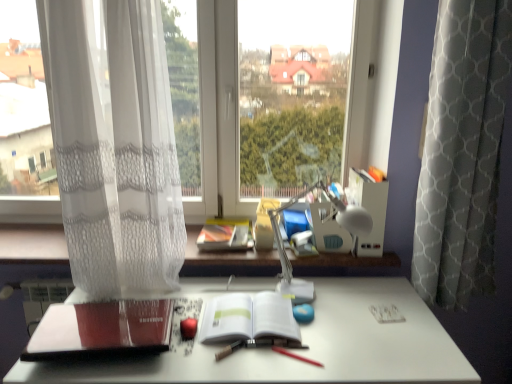
I want to click on vacant space situated on the left part of smooth red crayon at center, so click(248, 359).